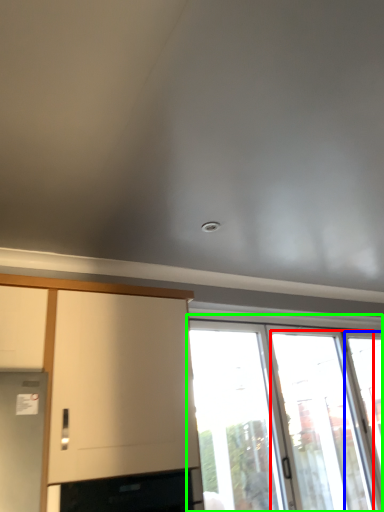
Question: Considering the real-world distances, which object is closest to screen door (highlighted by a red box)? window (highlighted by a blue box) or window (highlighted by a green box).

Choices:
 (A) window
 (B) window

Answer: (B)